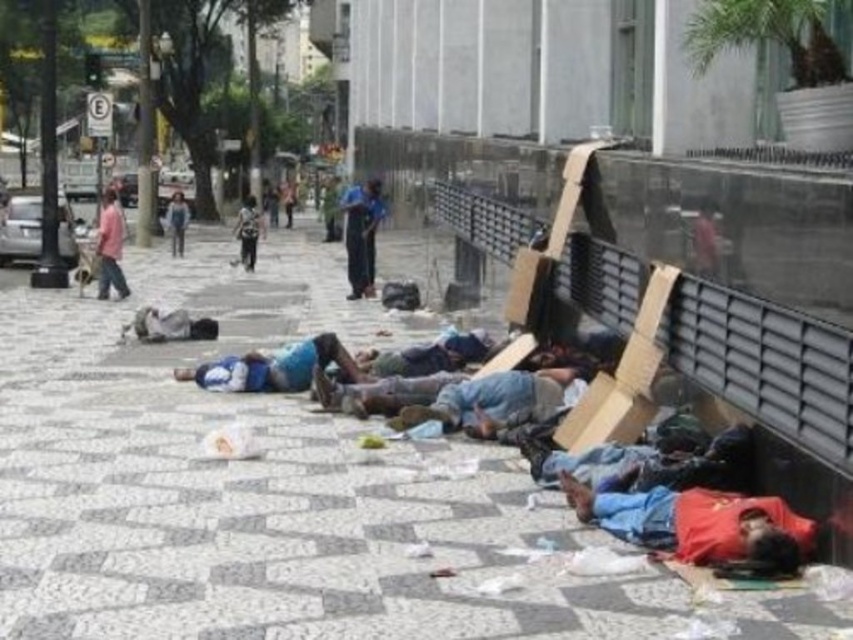
Question: Is white tile pavement at lower center closer to the viewer compared to blue fabric shirt at center?

Choices:
 (A) yes
 (B) no

Answer: (A)

Question: Which object is farther from the camera taking this photo?

Choices:
 (A) white tile pavement at lower center
 (B) blue fabric shirt at center

Answer: (B)

Question: Is red fabric shirt at lower right positioned at the back of denim pants at center?

Choices:
 (A) no
 (B) yes

Answer: (A)

Question: Is the position of white tile pavement at lower center less distant than that of denim pants at center?

Choices:
 (A) yes
 (B) no

Answer: (A)

Question: Estimate the real-world distances between objects in this image. Which object is closer to the red fabric shirt at lower right?

Choices:
 (A) blue fabric pants at center
 (B) white tile pavement at lower center

Answer: (B)

Question: Which point appears closest to the camera in this image?

Choices:
 (A) (177, 234)
 (B) (790, 561)
 (C) (347, 378)
 (D) (349, 268)

Answer: (B)